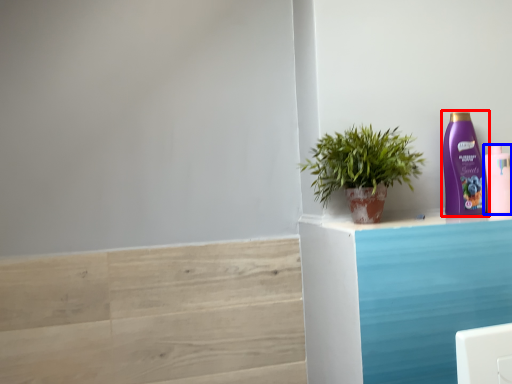
Question: Which object is closer to the camera taking this photo, bottle (highlighted by a red box) or bottle (highlighted by a blue box)?

Choices:
 (A) bottle
 (B) bottle

Answer: (A)